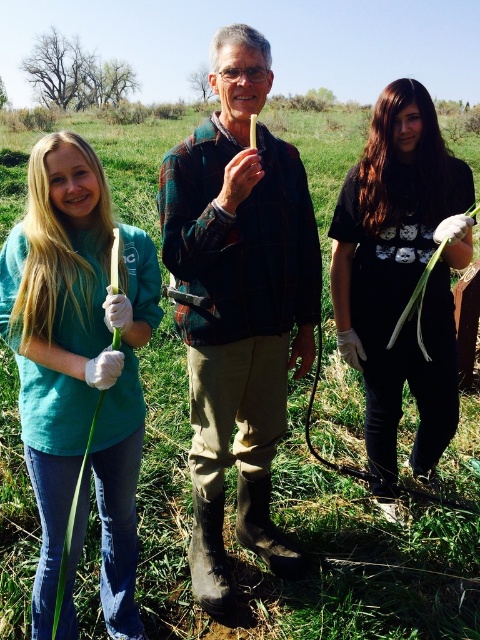
Can you confirm if green matte/gloved hand holding plant at left is positioned to the left of black cotton shirt at right?

Yes, green matte/gloved hand holding plant at left is to the left of black cotton shirt at right.

Locate an element on the screen. The width and height of the screenshot is (480, 640). green matte/gloved hand holding plant at left is located at coordinates (79, 371).

Find the location of a particular element. The image size is (480, 640). green matte plant at center is located at coordinates (239, 305).

Is green matte plant at center above black cotton shirt at right?

No, green matte plant at center is not above black cotton shirt at right.

Is point (218, 176) positioned before point (362, 170)?

Yes, it is in front of point (362, 170).

Locate an element on the screen. Image resolution: width=480 pixels, height=640 pixels. green matte plant at center is located at coordinates 239,305.

Is green matte plant at center above green matte/gloved hand holding plant at left?

Correct, green matte plant at center is located above green matte/gloved hand holding plant at left.

Between point (256, 508) and point (136, 388), which one is positioned behind?

The point (256, 508) is more distant.

Between point (264, 340) and point (120, 458), which one is positioned in front?

Point (120, 458) is in front.

Where is `green matte plant at center`? This screenshot has height=640, width=480. green matte plant at center is located at coordinates (239, 305).